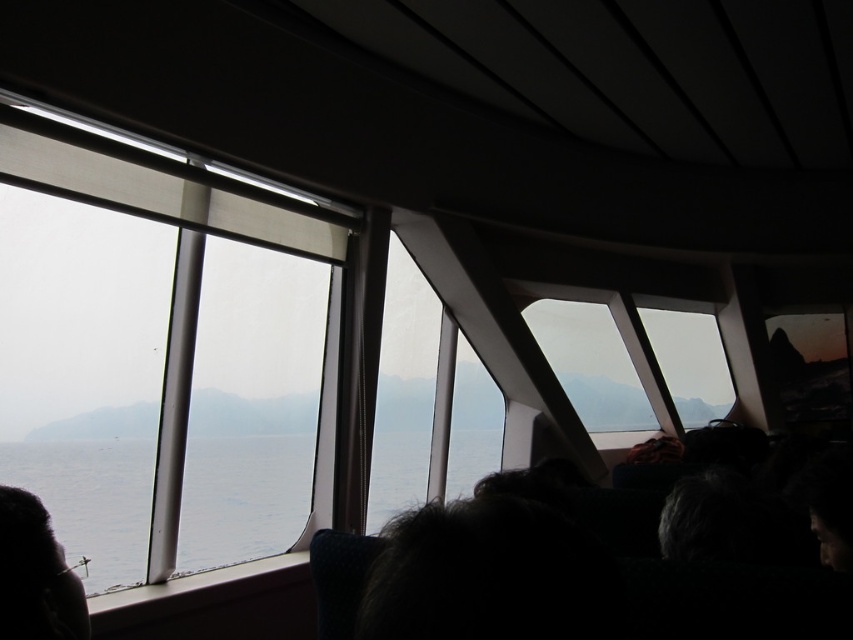
Does clear glass window at upper left have a lesser height compared to transparent glass water at center?

No.

What do you see at coordinates (161, 349) in the screenshot? The height and width of the screenshot is (640, 853). I see `clear glass window at upper left` at bounding box center [161, 349].

The image size is (853, 640). I want to click on clear glass window at upper left, so 161,349.

How distant is transparent glass water at center from dark hair at lower left?

The distance of transparent glass water at center from dark hair at lower left is 2.31 meters.

From the picture: Can you confirm if transparent glass water at center is thinner than dark hair at lower left?

No, transparent glass water at center is not thinner than dark hair at lower left.

Is point (57, 454) positioned in front of point (48, 515)?

No.

You are a GUI agent. You are given a task and a screenshot of the screen. Output one action in this format:
    pyautogui.click(x=<x>, y=<y>)
    Task: Click on the transparent glass water at center
    
    Given the screenshot: What is the action you would take?
    pyautogui.click(x=91, y=499)

Does clear glass window at upper left have a greater height compared to dark hair at lower left?

Correct, clear glass window at upper left is much taller as dark hair at lower left.

Does clear glass window at upper left lie behind dark hair at lower left?

Yes, it is.

What are the coordinates of `clear glass window at upper left` in the screenshot? It's located at (161, 349).